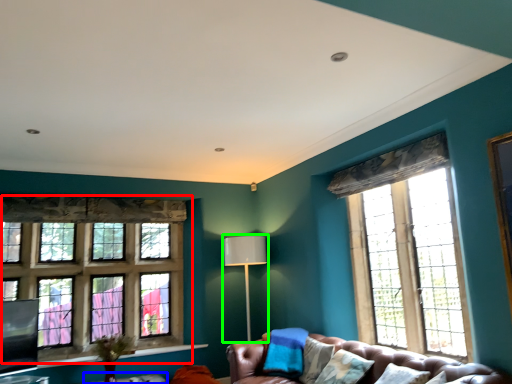
Question: Which object is the farthest from window (highlighted by a red box)? Choose among these: table (highlighted by a blue box) or lamp (highlighted by a green box).

Choices:
 (A) table
 (B) lamp

Answer: (B)